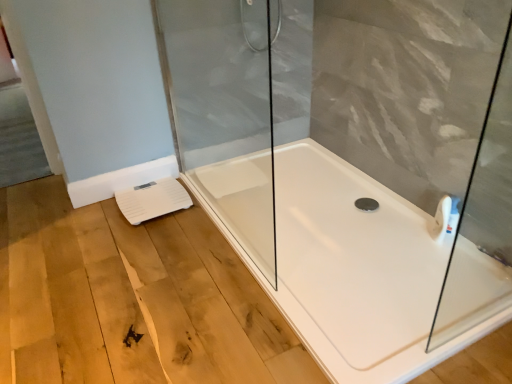
Identify the location of vacant region above white glossy bathtub at center (from a real-world perspective). The width and height of the screenshot is (512, 384). (242, 274).